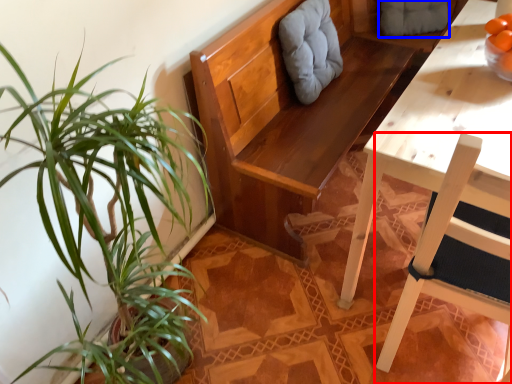
Question: Which of the following is the farthest to the observer, chair (highlighted by a red box) or swivel chair (highlighted by a blue box)?

Choices:
 (A) chair
 (B) swivel chair

Answer: (B)